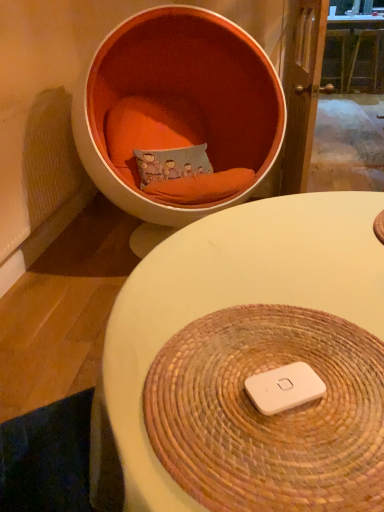
Where is `free space in front of white matte/ipod at center`? This screenshot has width=384, height=512. free space in front of white matte/ipod at center is located at coordinates (285, 459).